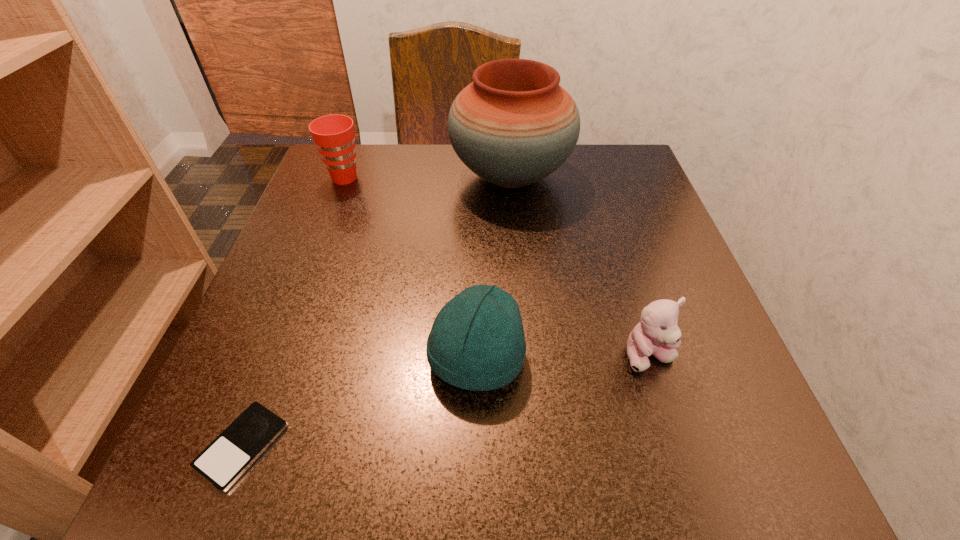
At what (x,y) coordinates should I click in order to perform the action: click on the tallest object. Please return your answer as a coordinate pair (x, y). Looking at the image, I should click on (514, 125).

This screenshot has height=540, width=960. Find the location of `cup`. cup is located at coordinates (334, 136).

I want to click on teddy bear, so click(x=657, y=334).

This screenshot has height=540, width=960. What are the coordinates of `beanie` in the screenshot? It's located at (477, 342).

I want to click on iPod, so 227,457.

I want to click on the nearest object, so click(227, 457).

The height and width of the screenshot is (540, 960). Identify the location of free space located on the right of the tallest object. (628, 176).

In order to click on vacant space located on the right of the cup in this screenshot , I will do `click(529, 178)`.

Image resolution: width=960 pixels, height=540 pixels. Find the location of `free space located at the face of the teddy bear`. free space located at the face of the teddy bear is located at coordinates (692, 494).

Where is `blank space located 0.180m on the left of the beanie`? blank space located 0.180m on the left of the beanie is located at coordinates (308, 358).